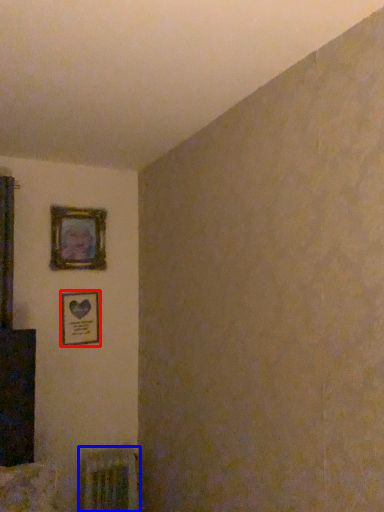
Question: Which point is further to the camera, picture frame (highlighted by a red box) or radiator (highlighted by a blue box)?

Choices:
 (A) picture frame
 (B) radiator

Answer: (A)